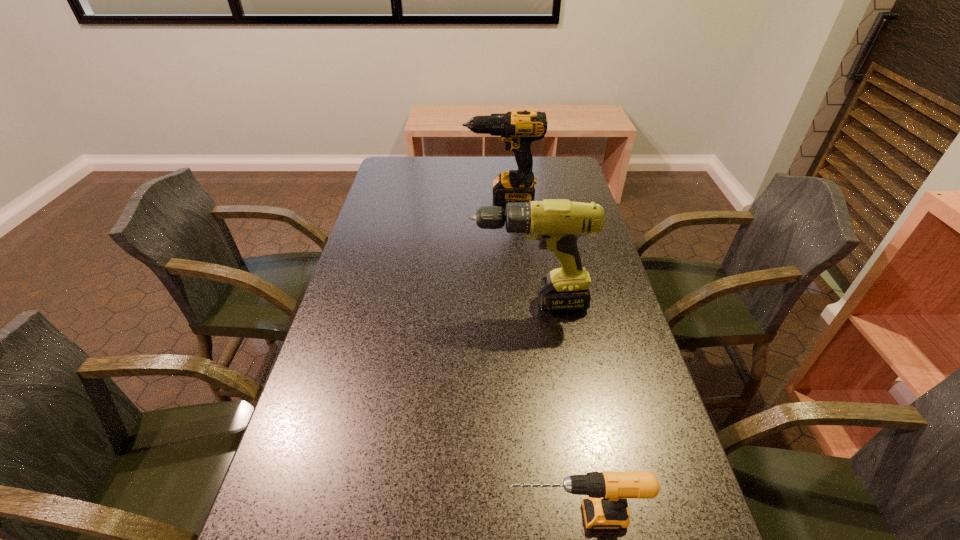
Where is `free space between the nearest drill and the second farthest object`? free space between the nearest drill and the second farthest object is located at coordinates (552, 409).

Where is `vacant area between the farthest drill and the second nearest object`? vacant area between the farthest drill and the second nearest object is located at coordinates (516, 251).

Locate an element on the screen. Image resolution: width=960 pixels, height=540 pixels. free point between the second nearest object and the farthest drill is located at coordinates (516, 251).

The image size is (960, 540). I want to click on free spot between the nearest object and the farthest drill, so click(539, 357).

Locate an element on the screen. Image resolution: width=960 pixels, height=540 pixels. object that is the second nearest to the farthest object is located at coordinates pos(606,508).

Choose which object is the second nearest neighbor to the farthest object. Please provide its 2D coordinates. Your answer should be formatted as a tuple, i.e. [(x, y)], where the tuple contains the x and y coordinates of a point satisfying the conditions above.

[(606, 508)]

The width and height of the screenshot is (960, 540). In order to click on drill that is the second closest to the second nearest drill in this screenshot , I will do `click(606, 508)`.

Identify the location of the second closest drill relative to the shortest object. (518, 129).